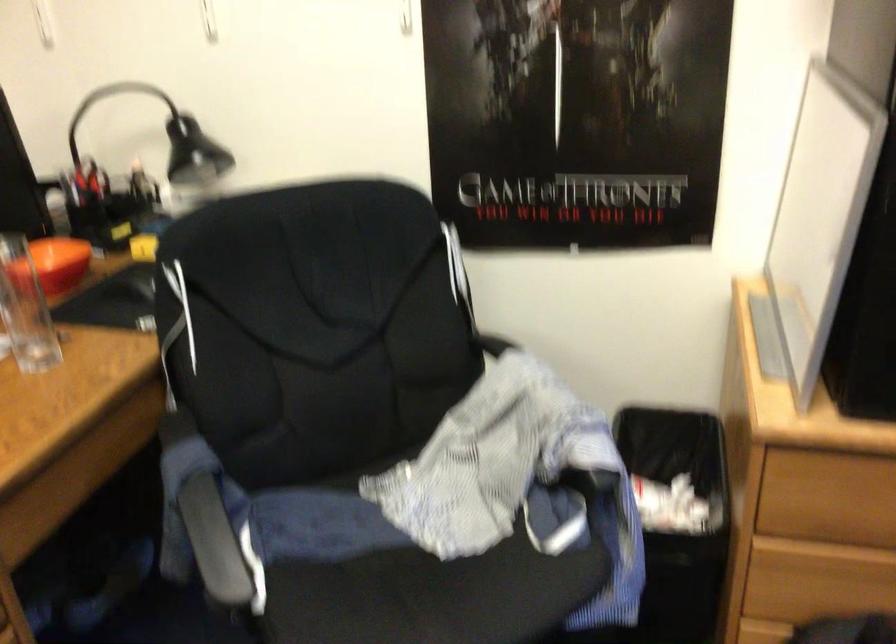
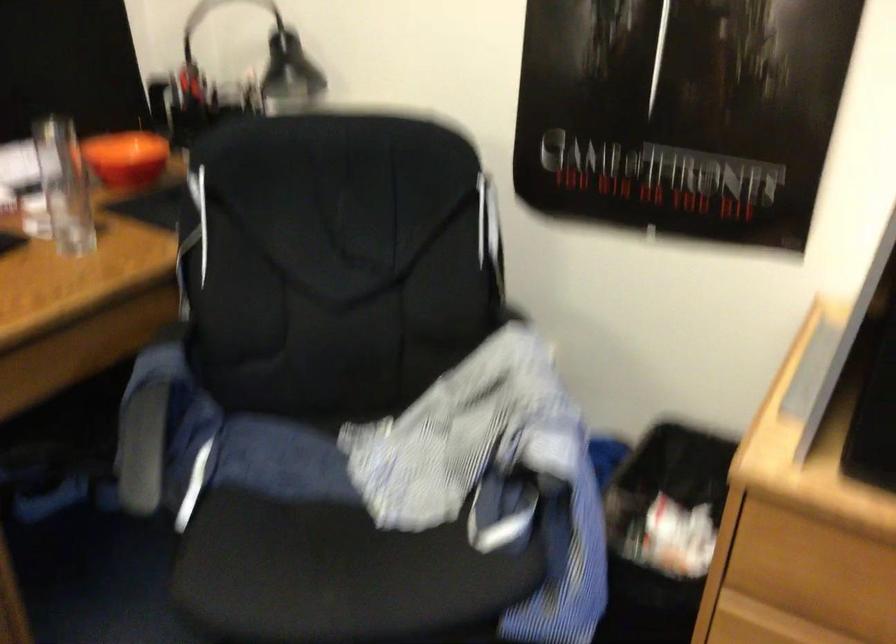
In the second image, find the point that corresponds to (x=112, y=169) in the first image.

(233, 82)